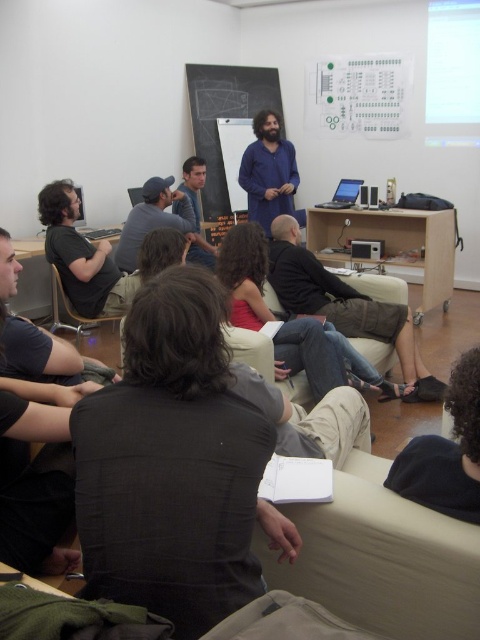
You are organizing a presentation and need to decide which item to place on a narrow shelf. The shelf can only hold items with a width of 10 cm or less. You have the blue cotton shirt at center and the matte black cap at center. Based on their sizes, which item can fit on the shelf?

The blue cotton shirt at center is thinner than the matte black cap at center, so the blue cotton shirt at center can fit on the shelf since it is thinner and likely within the 10 cm width limit.

From the picture: You are sitting on the beige couch and want to look at both the black cotton shirt at center and the dark gray shirt at left. Which one should you turn your head to the right to see?

To see the black cotton shirt at center, you should turn your head to the right because it is positioned to the right of the dark gray shirt at left.

Based on the photo, you are sitting at the back of the classroom and want to see both the matte black shirt at left and the matte blue shirt at center. Which one is lower in your field of view?

The matte black shirt at left is located below the matte blue shirt at center, so it is lower in your field of view.